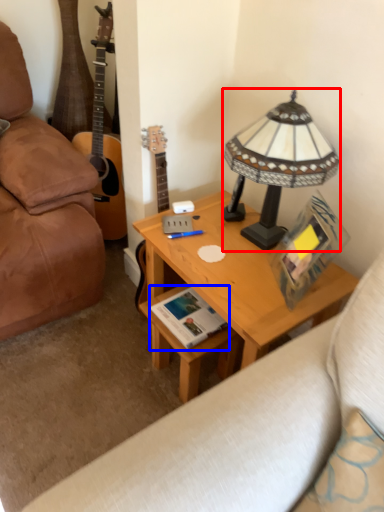
Question: Which point is closer to the camera, lamp (highlighted by a red box) or book (highlighted by a blue box)?

Choices:
 (A) lamp
 (B) book

Answer: (A)